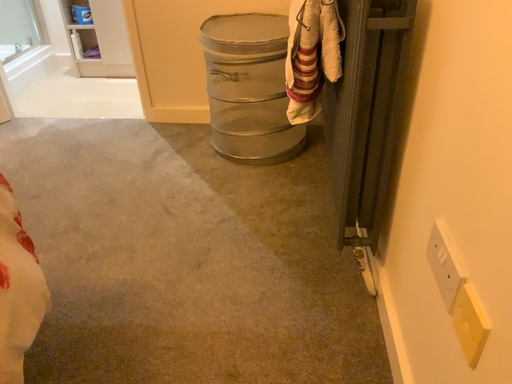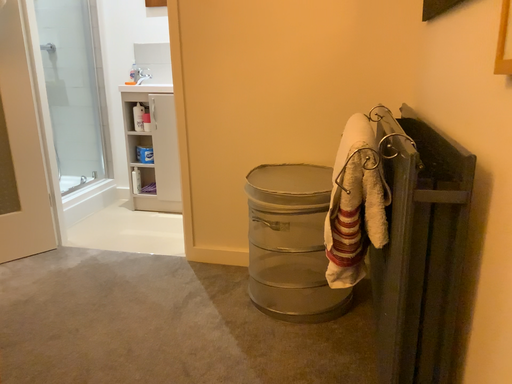
Question: Which way did the camera rotate in the video?

Choices:
 (A) rotated upward
 (B) rotated downward

Answer: (A)